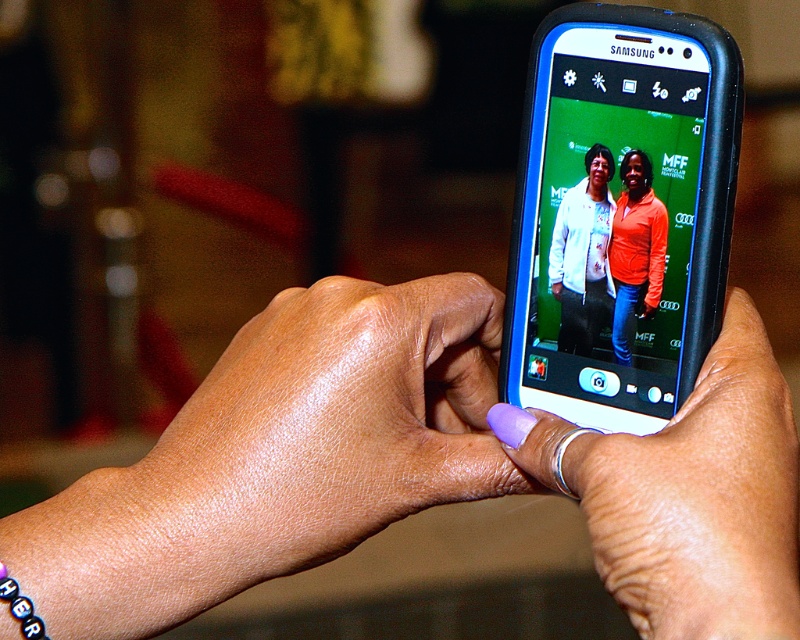
Question: Among these objects, which one is farthest from the camera?

Choices:
 (A) purple acrylic nail at center
 (B) orange fleece jacket at center

Answer: (B)

Question: Considering the real-world distances, which object is closest to the orange fleece jacket at center?

Choices:
 (A) purple acrylic nail at center
 (B) white matte jacket at center

Answer: (B)

Question: Considering the relative positions of purple nail polish at center and purple acrylic nail at center in the image provided, where is purple nail polish at center located with respect to purple acrylic nail at center?

Choices:
 (A) right
 (B) left

Answer: (B)

Question: Is the position of purple nail polish at center more distant than that of white matte jacket at center?

Choices:
 (A) yes
 (B) no

Answer: (B)

Question: Which of the following is the closest to the observer?

Choices:
 (A) (x=668, y=472)
 (B) (x=329, y=310)

Answer: (A)

Question: Is the position of purple acrylic nail at center more distant than that of white matte jacket at center?

Choices:
 (A) yes
 (B) no

Answer: (B)